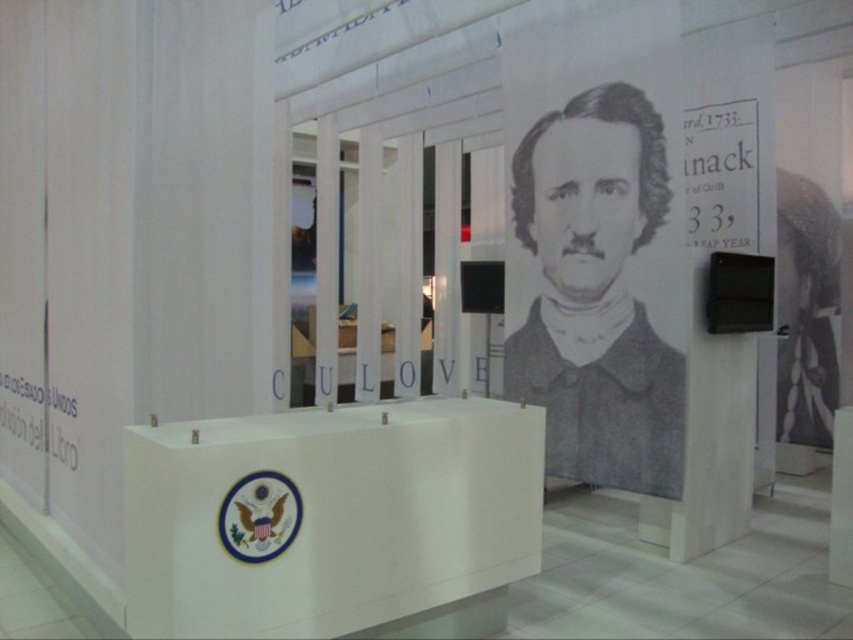
Does white glossy podium at center have a larger size compared to gray pencil portrait at center?

No, white glossy podium at center is not bigger than gray pencil portrait at center.

Which is above, white glossy podium at center or gray pencil portrait at center?

gray pencil portrait at center

At what (x,y) coordinates should I click in order to perform the action: click on white glossy podium at center. Please return your answer as a coordinate pair (x, y). The image size is (853, 640). Looking at the image, I should click on (328, 516).